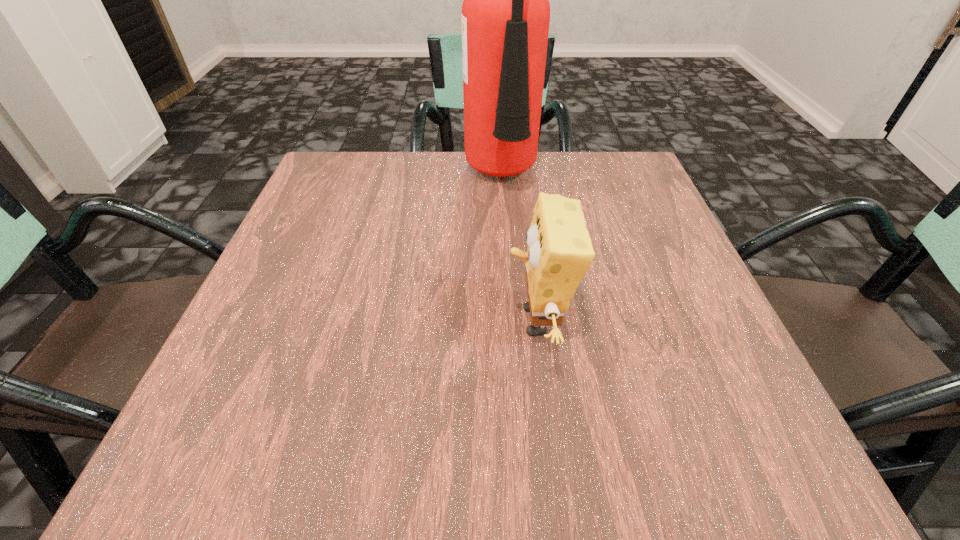
Find the location of `the farther object`. the farther object is located at coordinates (505, 17).

Find the location of a particular element. This screenshot has width=960, height=540. the taller object is located at coordinates (505, 17).

Where is `the shorter object`? This screenshot has height=540, width=960. the shorter object is located at coordinates (559, 253).

Identify the location of sponge. (559, 253).

Where is `vacant space located 0.270m at the nozzle of the fire extinguisher`? Image resolution: width=960 pixels, height=540 pixels. vacant space located 0.270m at the nozzle of the fire extinguisher is located at coordinates (527, 300).

Where is `vacant space situated 0.120m on the face of the shorter object`? vacant space situated 0.120m on the face of the shorter object is located at coordinates (431, 321).

Image resolution: width=960 pixels, height=540 pixels. I want to click on vacant space located on the face of the shorter object, so click(269, 321).

This screenshot has width=960, height=540. Identify the location of vacant space located on the face of the shorter object. (419, 321).

Image resolution: width=960 pixels, height=540 pixels. I want to click on object located in the far edge section of the desktop, so click(x=505, y=17).

Where is `vacant region at the far edge of the desktop`? The height and width of the screenshot is (540, 960). vacant region at the far edge of the desktop is located at coordinates (571, 167).